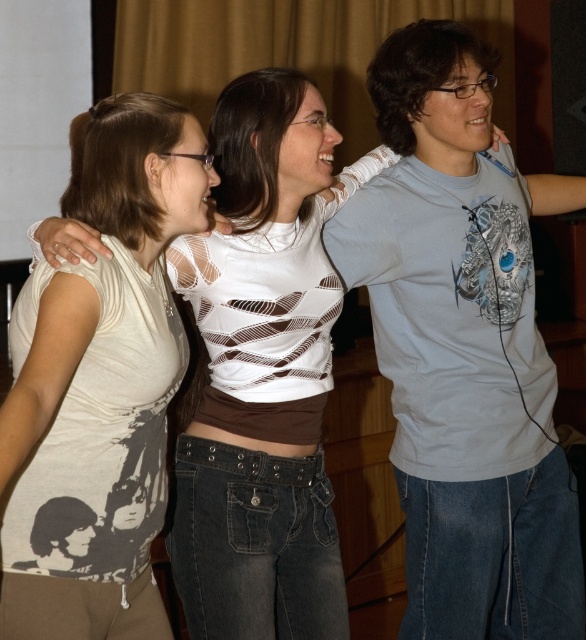
Question: Is white printed tank top at center above white printed shirt at center?

Choices:
 (A) no
 (B) yes

Answer: (A)

Question: Is light gray cotton t-shirt at center behind white printed shirt at center?

Choices:
 (A) no
 (B) yes

Answer: (B)

Question: Which of the following is the closest to the observer?

Choices:
 (A) click(486, 445)
 (B) click(154, 262)
 (C) click(318, 324)

Answer: (B)

Question: Which of the following is the farthest from the observer?

Choices:
 (A) (241, 176)
 (B) (97, 118)
 (C) (495, 474)

Answer: (C)

Question: Estimate the real-world distances between objects in this image. Which object is farther from the white printed shirt at center?

Choices:
 (A) light gray cotton t-shirt at center
 (B) white printed tank top at center

Answer: (A)

Question: Can you confirm if light gray cotton t-shirt at center is positioned above white printed shirt at center?

Choices:
 (A) no
 (B) yes

Answer: (B)